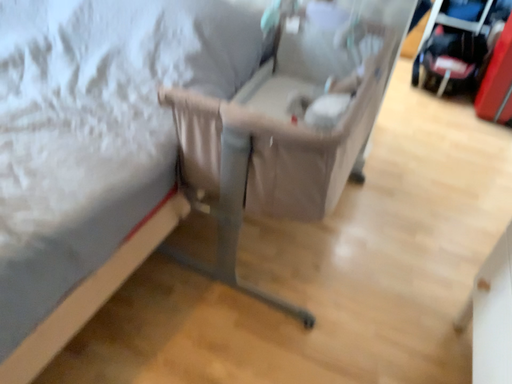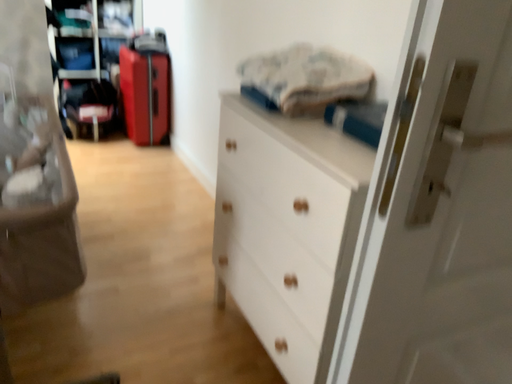
Question: Which way did the camera rotate in the video?

Choices:
 (A) rotated left
 (B) rotated right

Answer: (B)